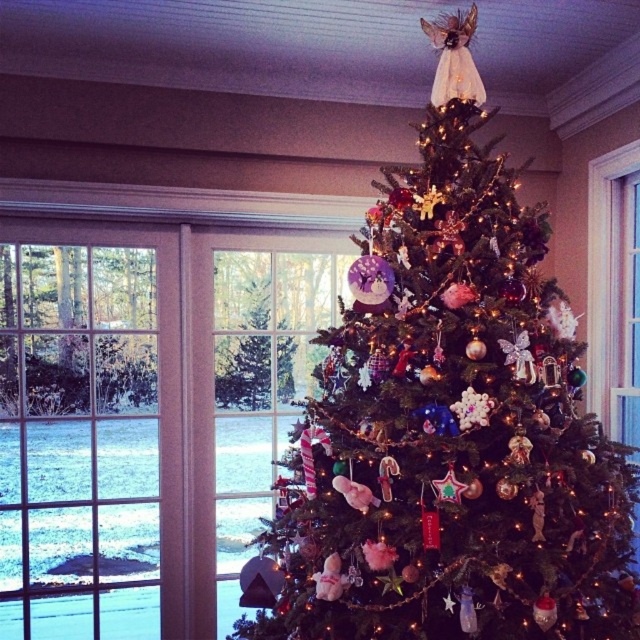
Based on the photo, you are a delivery person who needs to place a new 1 meter long Christmas decoration between the shiny green tree at center and the green matte tree at center. Is there enough space to place it horizontally between them?

The shiny green tree at center and green matte tree at center are 85.86 centimeters apart. Since the decoration is 1 meter long, which is longer than the space between them, it cannot be placed horizontally between them.